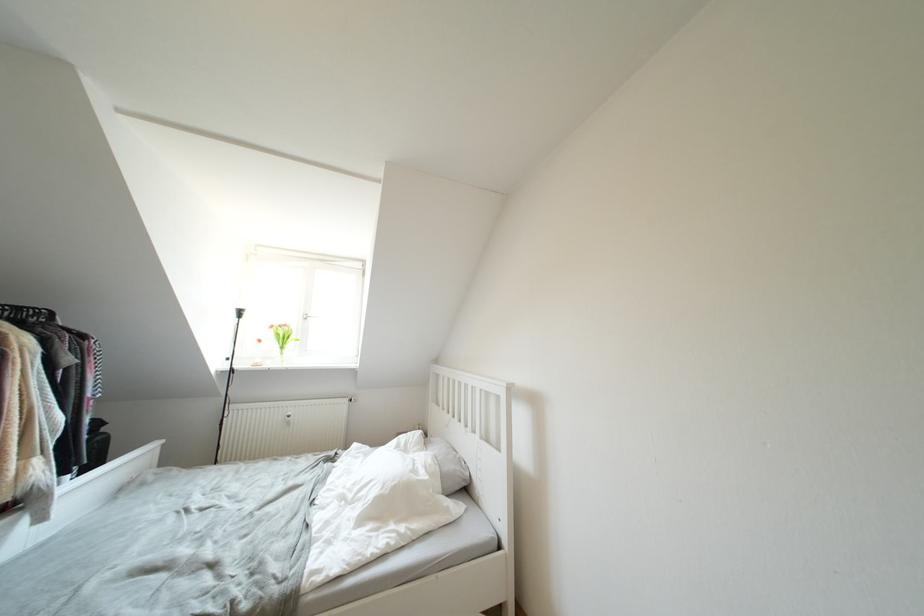
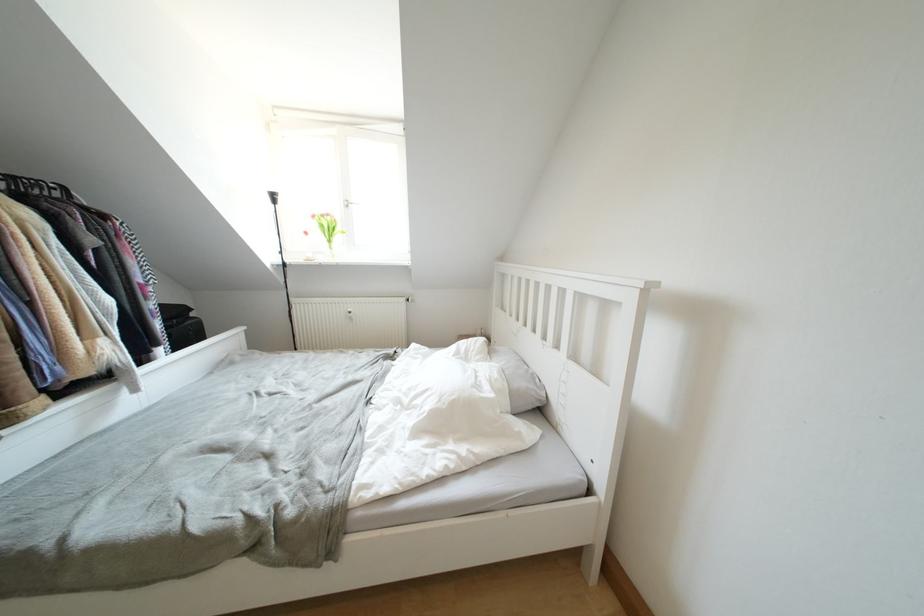
Find the pixel in the second image that matches pixel 276 331 in the first image.

(319, 220)